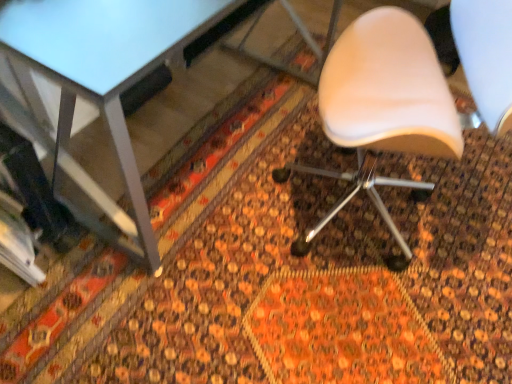
Question: Is white leather chair at center taller than metallic gray table at upper left?

Choices:
 (A) no
 (B) yes

Answer: (B)

Question: Does white leather chair at center come behind metallic gray table at upper left?

Choices:
 (A) yes
 (B) no

Answer: (B)

Question: From the image's perspective, is white leather chair at center under metallic gray table at upper left?

Choices:
 (A) no
 (B) yes

Answer: (B)

Question: Would you say white leather chair at center is a long distance from metallic gray table at upper left?

Choices:
 (A) yes
 (B) no

Answer: (B)

Question: Is white leather chair at center at the left side of metallic gray table at upper left?

Choices:
 (A) yes
 (B) no

Answer: (B)

Question: Is white leather chair at center wider than metallic gray table at upper left?

Choices:
 (A) no
 (B) yes

Answer: (B)

Question: Is metallic gray table at upper left to the left of white leather chair at center from the viewer's perspective?

Choices:
 (A) no
 (B) yes

Answer: (B)

Question: Does metallic gray table at upper left appear on the right side of white leather chair at center?

Choices:
 (A) yes
 (B) no

Answer: (B)

Question: From a real-world perspective, is metallic gray table at upper left on white leather chair at center?

Choices:
 (A) yes
 (B) no

Answer: (B)

Question: Can you confirm if metallic gray table at upper left is thinner than white leather chair at center?

Choices:
 (A) yes
 (B) no

Answer: (A)

Question: From the image's perspective, is metallic gray table at upper left beneath white leather chair at center?

Choices:
 (A) no
 (B) yes

Answer: (A)

Question: Would you consider metallic gray table at upper left to be distant from white leather chair at center?

Choices:
 (A) yes
 (B) no

Answer: (B)

Question: In terms of height, does white leather chair at center look taller or shorter compared to metallic gray table at upper left?

Choices:
 (A) short
 (B) tall

Answer: (B)